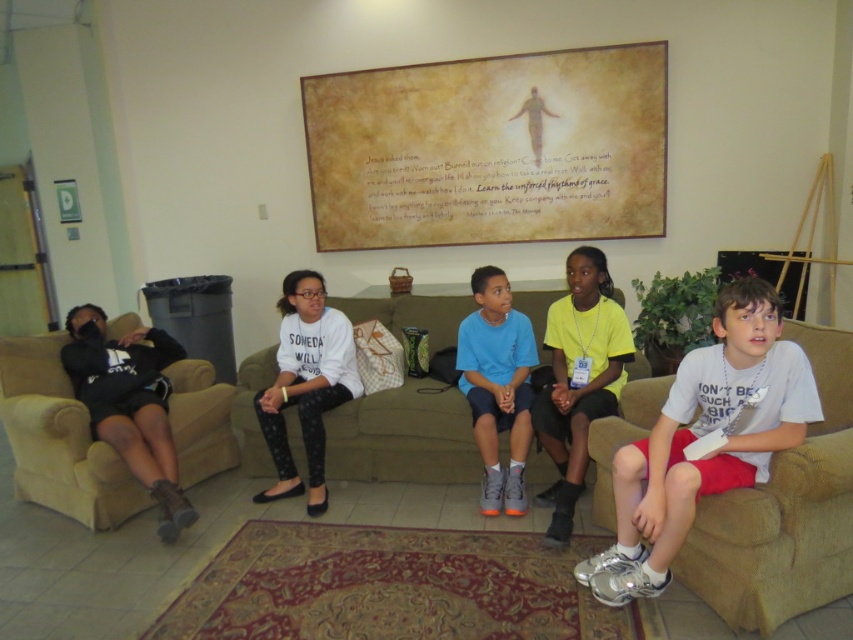
Question: Is green fabric couch at center to the left of white matte shirt at center from the viewer's perspective?

Choices:
 (A) no
 (B) yes

Answer: (A)

Question: Which point is closer to the camera?

Choices:
 (A) (68, 371)
 (B) (651, 548)

Answer: (B)

Question: Does white matte shirt at center appear on the left side of blue matte sneakers at center?

Choices:
 (A) no
 (B) yes

Answer: (B)

Question: Which point is farther from the camera taking this photo?

Choices:
 (A) (467, 458)
 (B) (94, 368)

Answer: (B)

Question: Is green fabric couch at center positioned before black suede boots at left?

Choices:
 (A) no
 (B) yes

Answer: (A)

Question: Estimate the real-world distances between objects in this image. Which object is closer to the white cotton shirt at right?

Choices:
 (A) white matte shirt at center
 (B) yellow matte shirt at center
 (C) black suede boots at left
 (D) green fabric couch at center

Answer: (B)